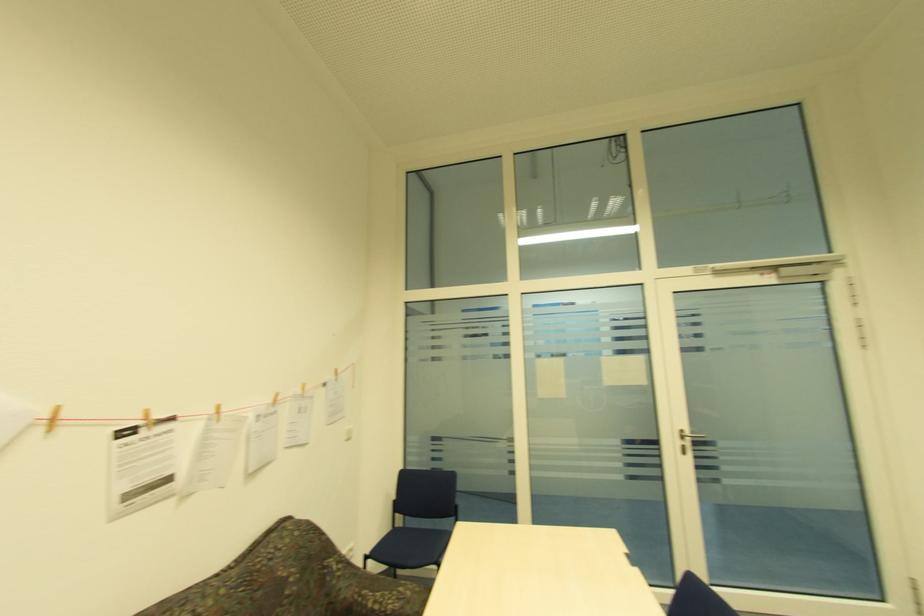
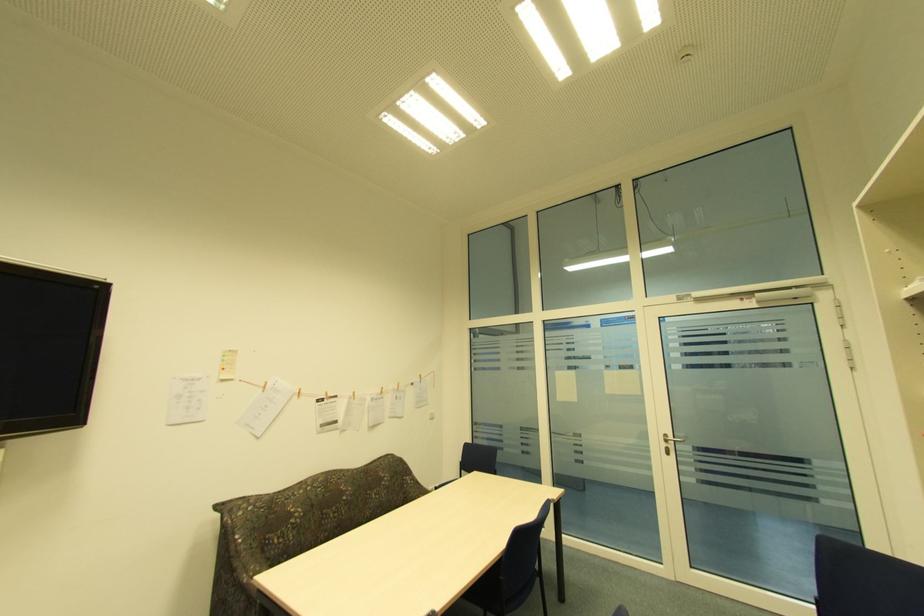
What movement of the cameraman would produce the second image?

The cameraman walked toward right, backward.